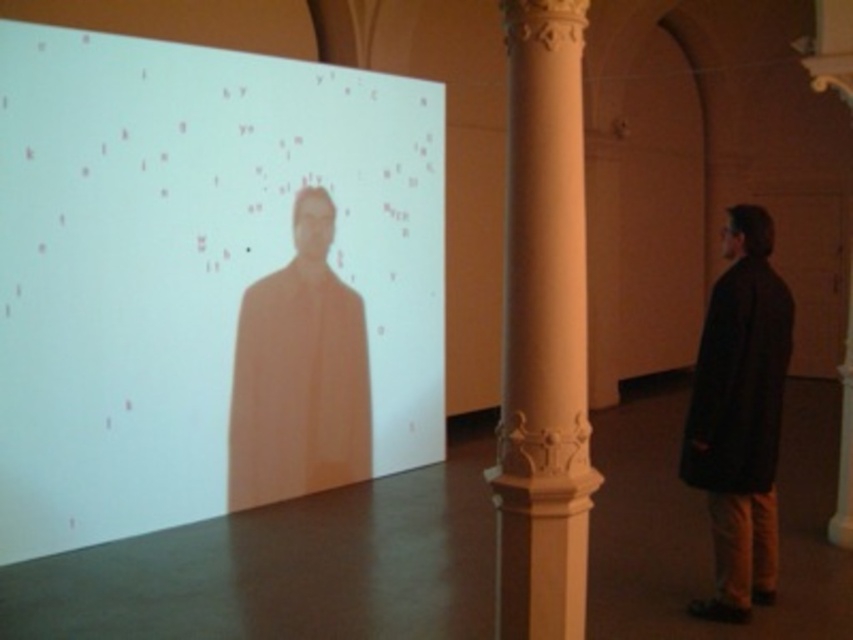
You are an art curator standing 5 feet away from the white marble pillar at center. You need to retrieve the dark matte coat at right. Can you reach it without moving closer than your current distance?

The dark matte coat at right is 4.99 feet away from the white marble pillar at center. Since you are already 5 feet away from the pillar, you are just slightly farther than the coat. To reach the coat, you would need to move closer to the pillar by approximately 0.01 feet, which is negligible. However, practically, maintaining a distance of exactly 5 feet might make it difficult to reach without stepping closer.

You are an interior designer planning to place a new sofa in this space. The sofa you have chosen is wider than the white marble pillar at center. Will the dark matte coat at right fit in the available space if you place the sofa where the coat currently is?

The dark matte coat at right is wider than the white marble pillar at center. Since the sofa is also wider than the white marble pillar at center, it is possible that the sofa may be wider than the coat. Therefore, the dark matte coat at right might fit in the space if the sofa is placed there, but this depends on the exact dimensions of both the sofa and the coat. Without specific measurements, it is uncertain.

You are an art curator planning to hang a new sculpture in this space. The sculpture requires a wall area that is free of obstructions. Based on the scene, is the area at point coordinates [202,278] suitable for hanging the sculpture?

The area at point coordinates [202,278] is occupied by a white matte projection screen at upper left, so it is not suitable for hanging the sculpture.